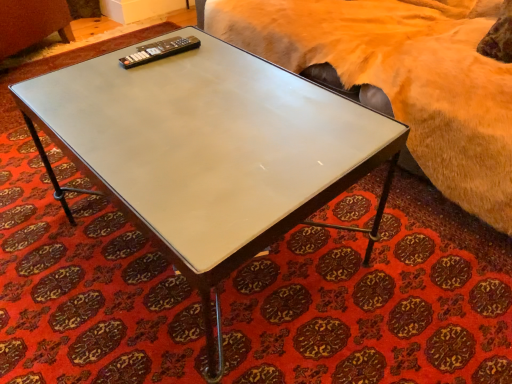
You are a GUI agent. You are given a task and a screenshot of the screen. Output one action in this format:
    pyautogui.click(x=<x>, y=<y>)
    Task: Click on the vacant area that lies to the right of white glossy coffee table at center
    
    Given the screenshot: What is the action you would take?
    pyautogui.click(x=409, y=268)